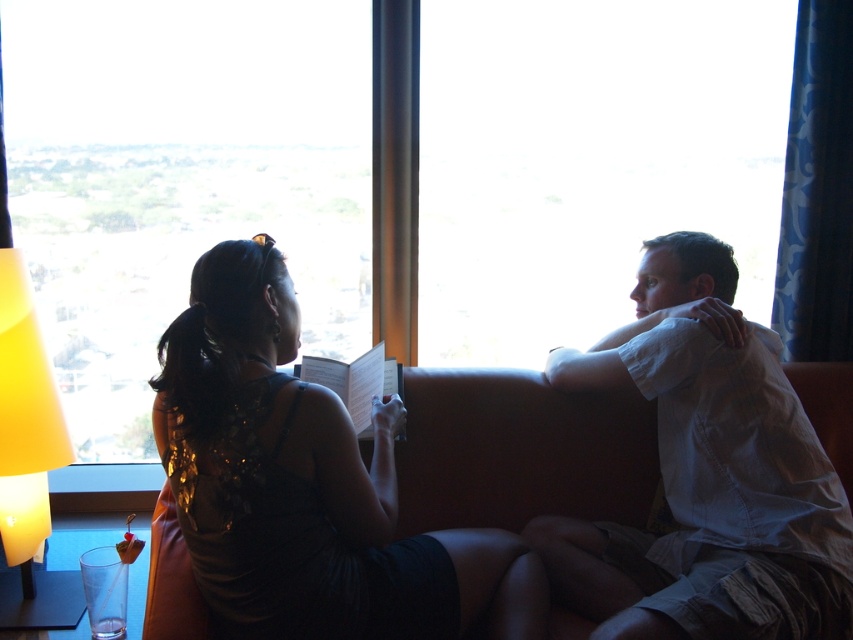
You are a tailor measuring fabric for alterations. You need to determine if a 1.2 meter wide fabric piece is sufficient to cover the white cotton shirt at right and the orange leather couch at center. Based on their widths, can the fabric accommodate both items?

The white cotton shirt at right has a lesser width compared to orange leather couch at center. Since the fabric is 1.2 meters wide, it can cover both items as long as their combined width does not exceed 1.2 meters. However, without knowing the exact width of the orange leather couch at center, we cannot confirm if the fabric is sufficient.

Consider the image. You are a tailor measuring garments for alterations. You see the white cotton shirt at right and the orange leather couch at center. Which item is taller?

The white cotton shirt at right is taller than the orange leather couch at center according to the description.

You are a photographer taking a picture of the scene. You want to focus on the white paper book at center without the white cotton shirt at right blocking it. Can you adjust your position to achieve this?

The white cotton shirt at right is in front of the white paper book at center, so moving your camera position to the left or right might allow you to reposition the shirt out of the frame or behind the book.